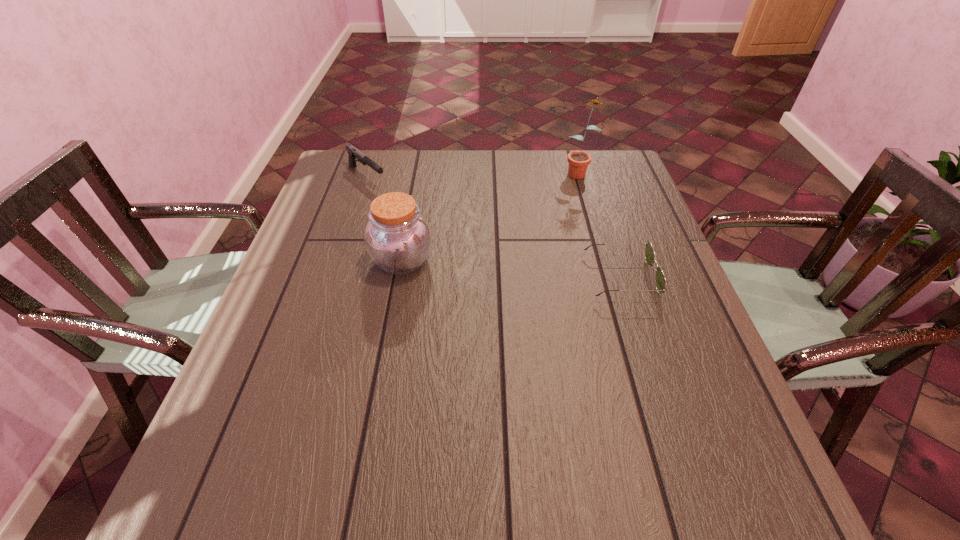
At what (x,y) coordinates should I click in order to perform the action: click on free point that satisfies the following two spatial constraints: 1. on the front side of the third object from right to left; 2. on the front-facing side of the shortest object. Please return your answer as a coordinate pair (x, y). The height and width of the screenshot is (540, 960). Looking at the image, I should click on (399, 276).

You are a GUI agent. You are given a task and a screenshot of the screen. Output one action in this format:
    pyautogui.click(x=<x>, y=<y>)
    Task: Click on the free point that satisfies the following two spatial constraints: 1. on the front side of the second object from left to right; 2. on the left side of the gun
    Image resolution: width=960 pixels, height=540 pixels.
    Given the screenshot: What is the action you would take?
    pyautogui.click(x=339, y=261)

At what (x,y) coordinates should I click in order to perform the action: click on vacant region that satisfies the following two spatial constraints: 1. on the front side of the tallest object; 2. on the front-facing side of the shortest object. Please return your answer as a coordinate pair (x, y). The image size is (960, 540). Looking at the image, I should click on (610, 276).